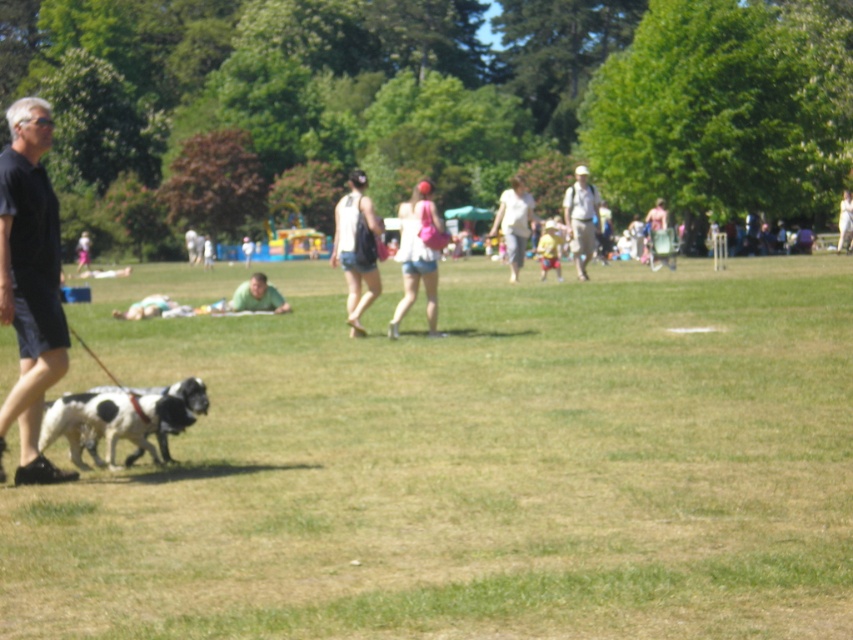
You are standing at the center of the park and want to find the green grass at lower left. According to the coordinates provided, in which direction should you move to reach it?

The green grass at lower left is located at point coordinates lower left, so you should move towards the lower left direction to reach it.